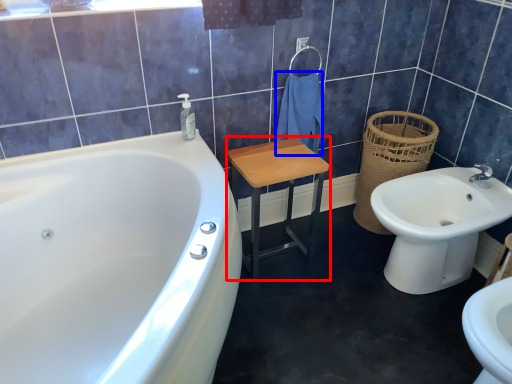
Question: Which object appears farthest to the camera in this image, step stool (highlighted by a red box) or bath towel (highlighted by a blue box)?

Choices:
 (A) step stool
 (B) bath towel

Answer: (B)